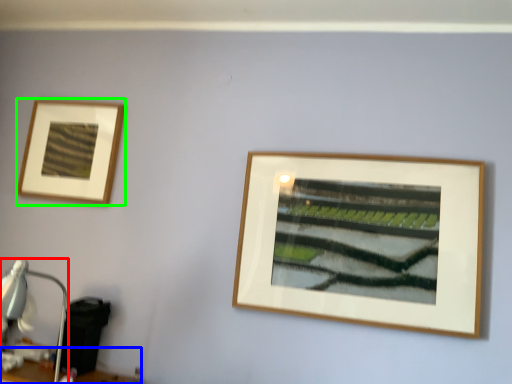
Question: Considering the real-world distances, which object is farthest from table lamp (highlighted by a red box)? table (highlighted by a blue box) or picture frame (highlighted by a green box)?

Choices:
 (A) table
 (B) picture frame

Answer: (B)